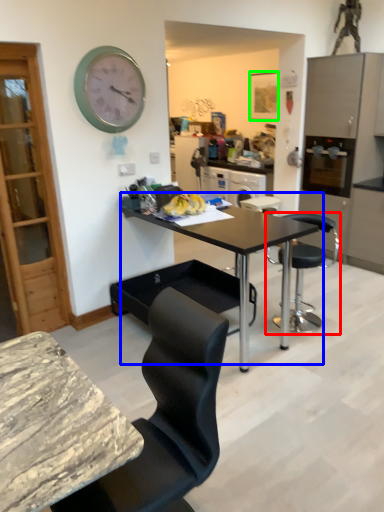
Question: Which is nearer to the chair (highlighted by a red box)? table (highlighted by a blue box) or picture frame (highlighted by a green box).

Choices:
 (A) table
 (B) picture frame

Answer: (A)